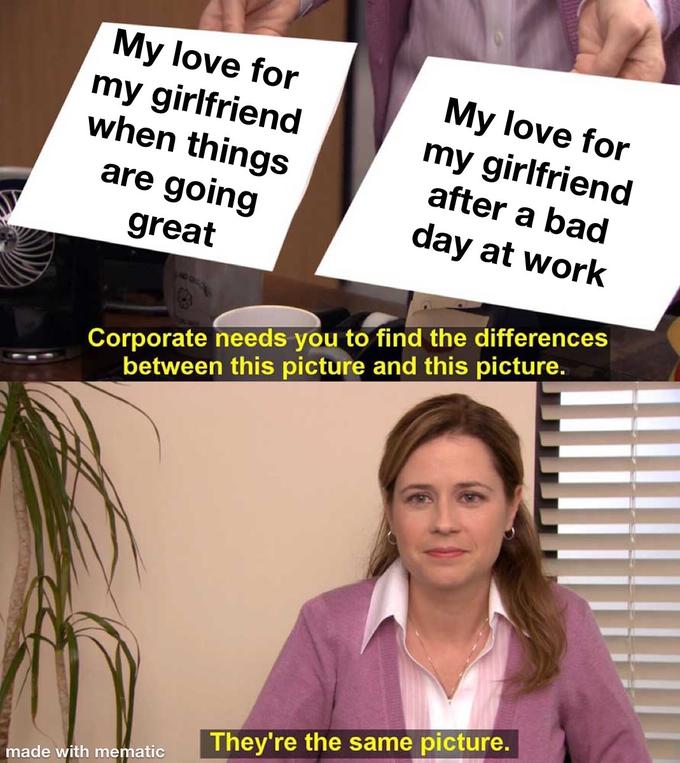
Locate an element on the screen. window blinds is located at coordinates (638, 452).